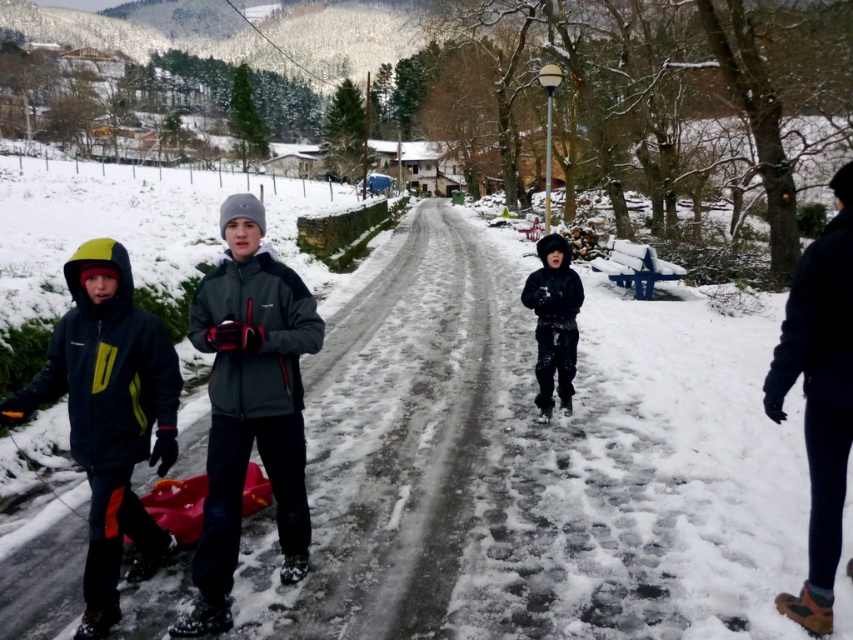
Question: Based on their relative distances, which object is nearer to the dark blue fabric pants at right?

Choices:
 (A) black matte jacket at left
 (B) matte gray jacket at center

Answer: (B)

Question: Can you confirm if black matte jacket at left is positioned to the left of black matte snowsuit at center?

Choices:
 (A) yes
 (B) no

Answer: (A)

Question: Among these points, which one is farthest from the camera?

Choices:
 (A) (830, 568)
 (B) (558, 307)
 (C) (97, 540)

Answer: (B)

Question: Can you confirm if matte gray jacket at center is positioned to the right of black matte jacket at left?

Choices:
 (A) yes
 (B) no

Answer: (A)

Question: Which of these objects is positioned farthest from the black matte snowsuit at center?

Choices:
 (A) black matte jacket at left
 (B) dark blue fabric pants at right
 (C) matte gray jacket at center

Answer: (A)

Question: Does black matte jacket at left appear on the right side of black matte snowsuit at center?

Choices:
 (A) no
 (B) yes

Answer: (A)